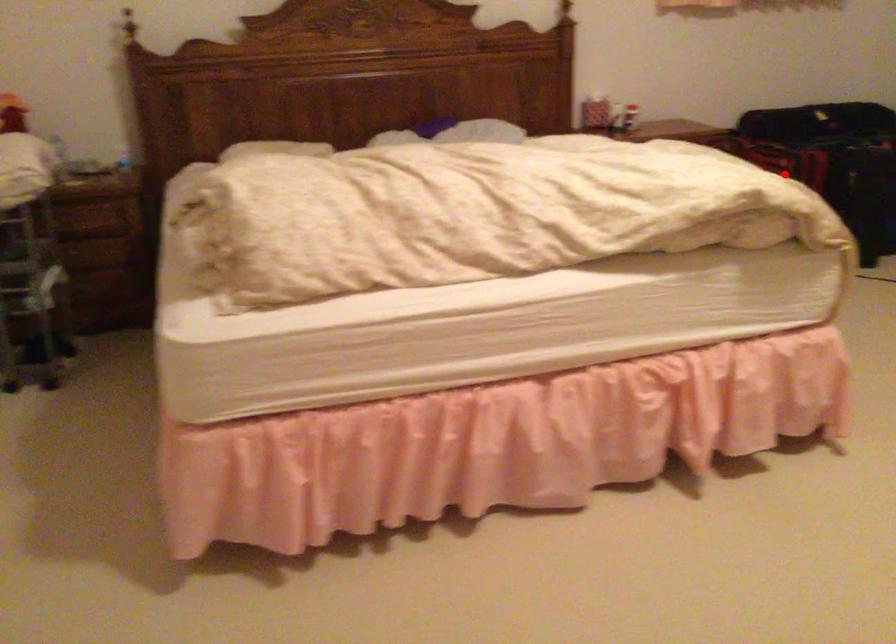
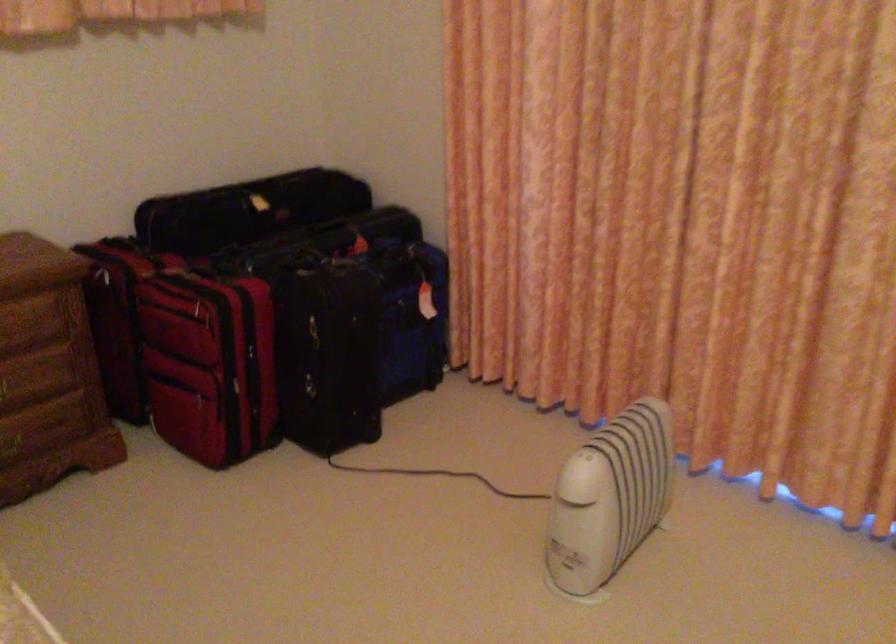
Locate, in the second image, the point that corresponds to the highlighted location in the first image.

(209, 364)